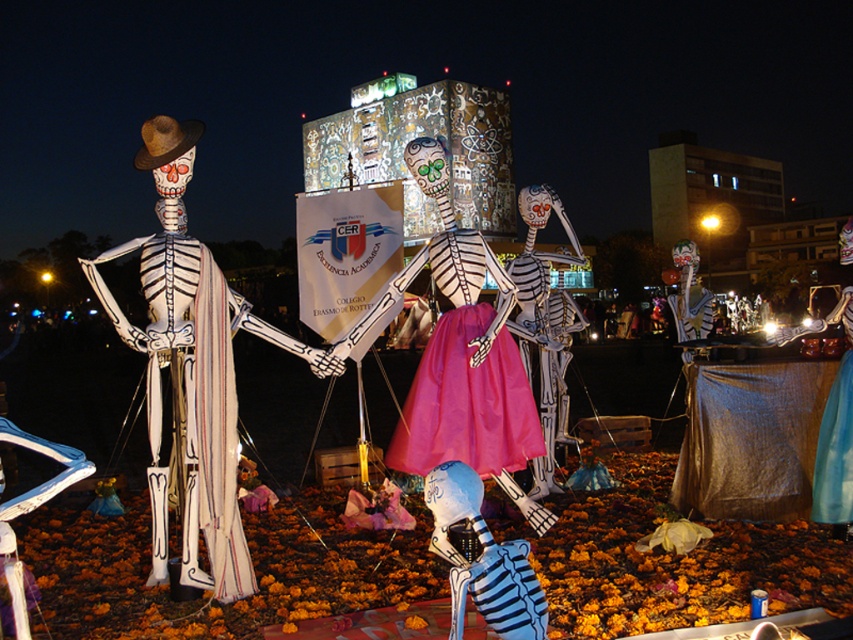
Question: Which point is closer to the camera?

Choices:
 (A) white paper skeleton at left
 (B) blue painted skeleton at lower center

Answer: (B)

Question: Does blue painted skeleton at lower center have a larger size compared to blue fabric dress at center?

Choices:
 (A) no
 (B) yes

Answer: (A)

Question: Does pink satin dress at center appear over blue painted skeleton at lower center?

Choices:
 (A) yes
 (B) no

Answer: (A)

Question: Which point appears farthest from the camera in this image?

Choices:
 (A) (850, 355)
 (B) (196, 122)

Answer: (A)

Question: Which point is farther to the camera?

Choices:
 (A) (177, 396)
 (B) (451, 634)
 (C) (845, 518)
 (D) (430, 410)

Answer: (D)

Question: Is white paper skeleton at left further to camera compared to pink satin dress at center?

Choices:
 (A) no
 (B) yes

Answer: (A)